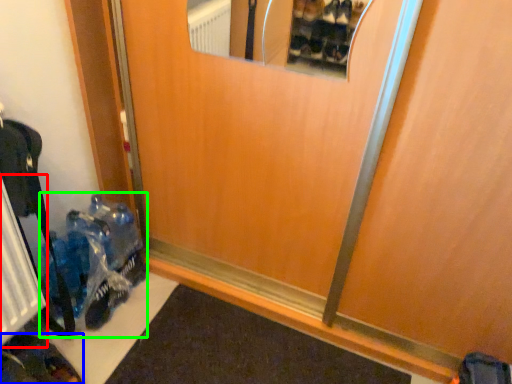
Question: Which object is the farthest from radiator (highlighted by a red box)? Choose among these: footwear (highlighted by a blue box) or toy (highlighted by a green box).

Choices:
 (A) footwear
 (B) toy

Answer: (A)